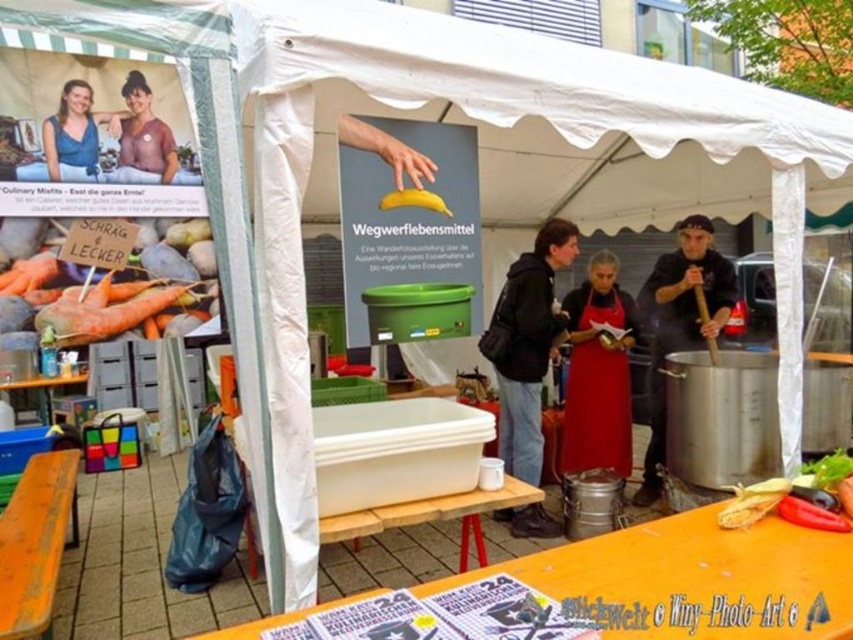
Looking at this image, can you confirm if black leather hat at center is taller than yellow matte banana at center?

Indeed, black leather hat at center has a greater height compared to yellow matte banana at center.

Is black leather hat at center wider than yellow matte banana at center?

Indeed, black leather hat at center has a greater width compared to yellow matte banana at center.

What do you see at coordinates (680, 323) in the screenshot? The width and height of the screenshot is (853, 640). I see `black leather hat at center` at bounding box center [680, 323].

Locate an element on the screen. The width and height of the screenshot is (853, 640). black leather hat at center is located at coordinates (680, 323).

Who is lower down, orange matte carrots at lower left or black matte jacket at center?

Positioned lower is black matte jacket at center.

Is orange matte carrots at lower left below black matte jacket at center?

No.

Is point (172, 289) farther from viewer compared to point (540, 340)?

No, it is not.

Identify the location of orange matte carrots at lower left. The width and height of the screenshot is (853, 640). (113, 282).

Between matte white poster at center and red matte pepper at lower right, which one is positioned higher?

matte white poster at center is above.

Does point (433, 154) lie in front of point (849, 524)?

Yes, it is in front of point (849, 524).

The width and height of the screenshot is (853, 640). In order to click on matte white poster at center in this screenshot , I will do `click(409, 220)`.